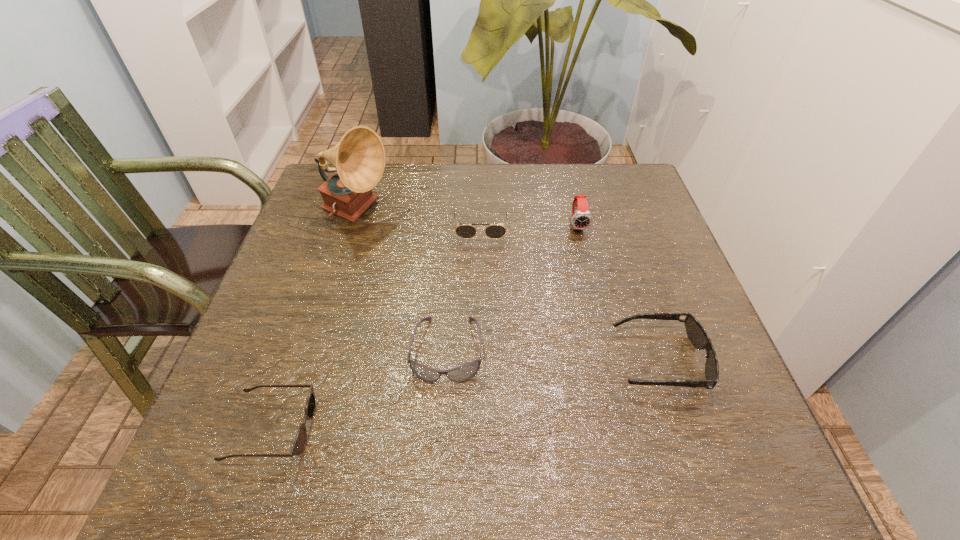
This screenshot has width=960, height=540. In order to click on free space between the phonograph record and the tallest sunglasses in this screenshot , I will do coord(419,222).

This screenshot has height=540, width=960. In order to click on empty space that is in between the fifth shortest object and the shortest sunglasses in this screenshot , I will do `click(425, 327)`.

Image resolution: width=960 pixels, height=540 pixels. Find the location of `vacant region between the shortest sunglasses and the second tallest object`. vacant region between the shortest sunglasses and the second tallest object is located at coordinates (425, 327).

This screenshot has height=540, width=960. What are the coordinates of `free area in between the second tallest object and the tallest sunglasses` in the screenshot? It's located at (529, 227).

Find the location of `unoccupied area between the farthest sunglasses and the rightmost sunglasses`. unoccupied area between the farthest sunglasses and the rightmost sunglasses is located at coordinates (570, 295).

Find the location of a particular element. The image size is (960, 540). free space between the tallest object and the fifth shortest object is located at coordinates (468, 219).

I want to click on empty space between the farthest sunglasses and the rightmost sunglasses, so click(570, 295).

The width and height of the screenshot is (960, 540). Find the location of `object that is the fifth closest to the fifth shortest object`. object that is the fifth closest to the fifth shortest object is located at coordinates (299, 444).

Where is `object that is the closest to the phonograph record`? The width and height of the screenshot is (960, 540). object that is the closest to the phonograph record is located at coordinates (493, 231).

Identify the location of sunglasses that is the third closest to the phonograph record. (299, 444).